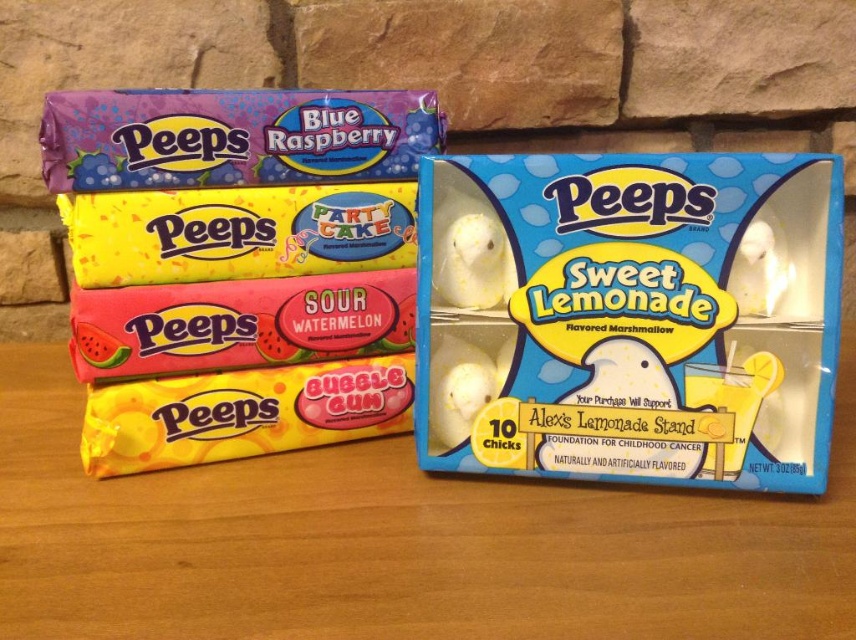
Between point (269, 157) and point (117, 406), which one is positioned behind?

The point (269, 157) is behind.

Looking at this image, who is taller, matte plastic peeps at left or yellow matte bubble gum at lower left?

matte plastic peeps at left is taller.

Is point (147, 440) positioned after point (391, 378)?

No, (147, 440) is in front of (391, 378).

Identify the location of matte plastic peeps at left. (248, 273).

Between point (212, 605) and point (256, 444), which one is positioned behind?

The point (256, 444) is behind.

Who is positioned more to the left, wooden table at center or yellow matte bubble gum at lower left?

yellow matte bubble gum at lower left

Where is `wooden table at center`? This screenshot has width=856, height=640. wooden table at center is located at coordinates (397, 541).

Who is higher up, yellow glossy marshmallow at center or yellow matte bubble gum at lower left?

Positioned higher is yellow glossy marshmallow at center.

Is point (378, 237) farther from viewer compared to point (189, 419)?

Yes, point (378, 237) is farther from viewer.

Locate an element on the screen. yellow glossy marshmallow at center is located at coordinates (236, 232).